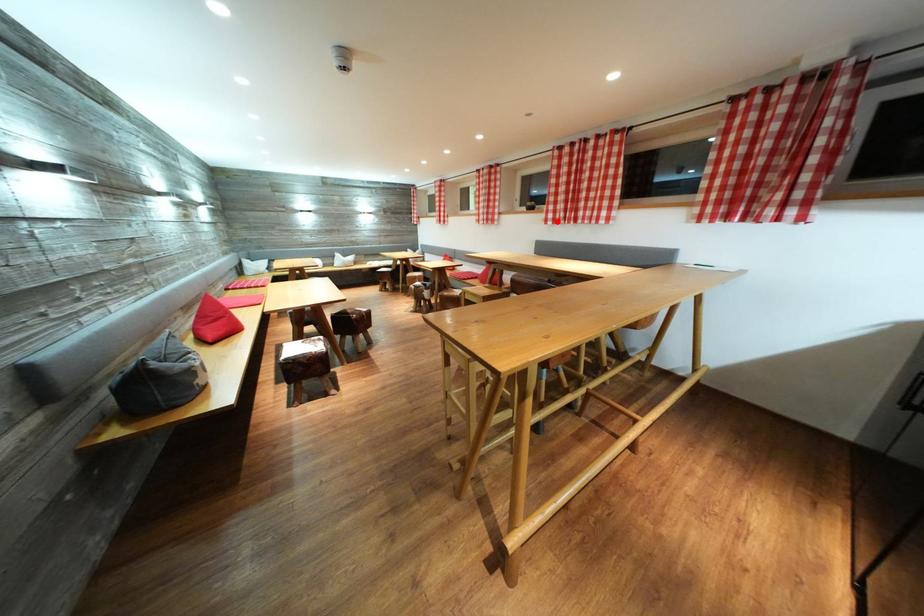
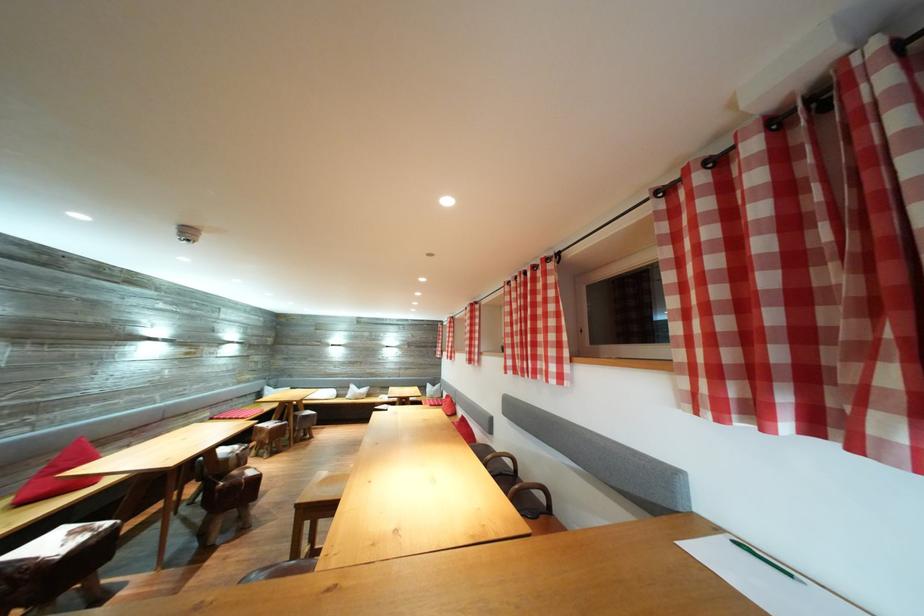
Where in the second image is the point corresponding to the highlighted location from the first image?

(517, 368)